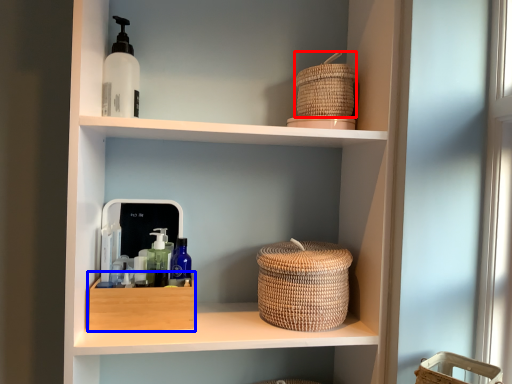
Question: Which object appears farthest to the camera in this image, basket (highlighted by a red box) or storage box (highlighted by a blue box)?

Choices:
 (A) basket
 (B) storage box

Answer: (A)